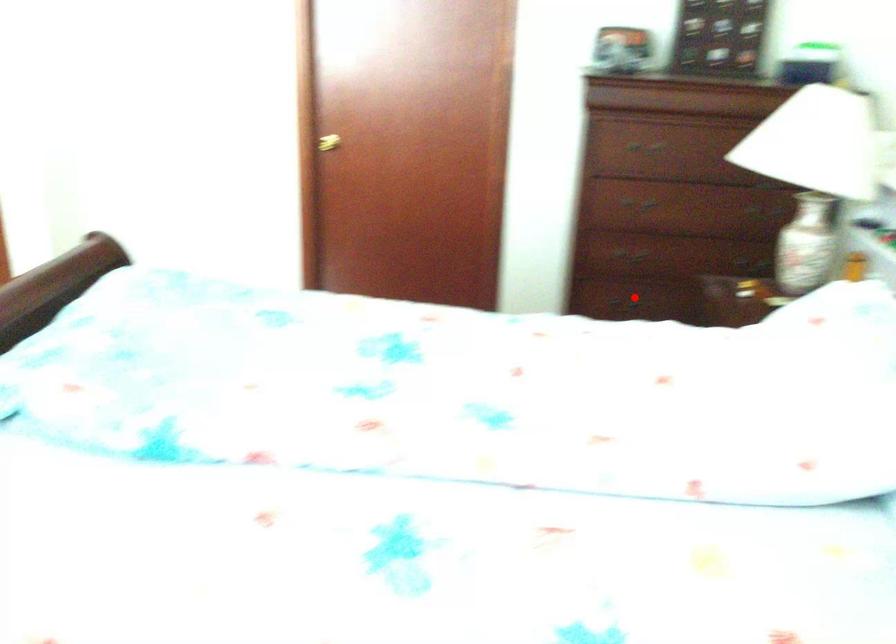
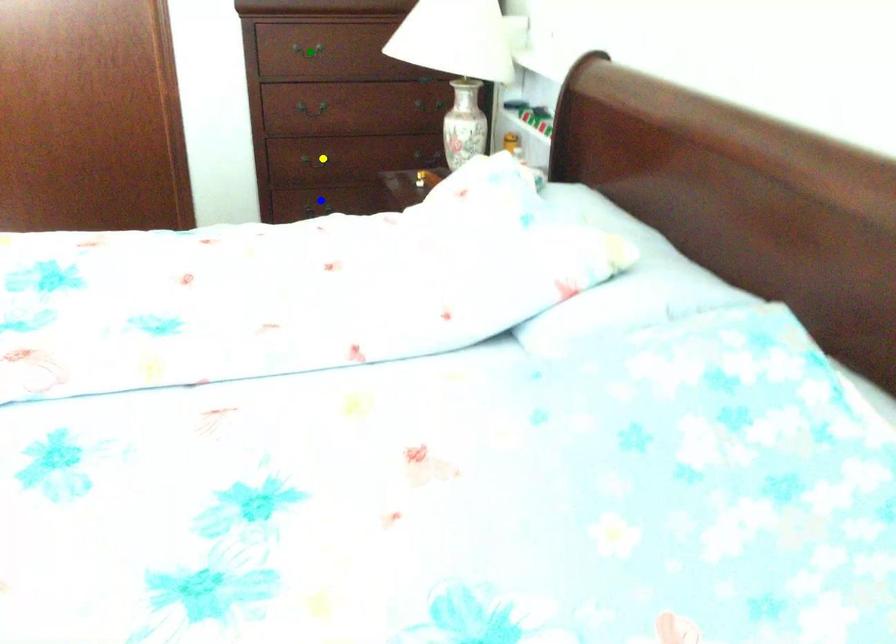
Question: I am providing you with two images of the same scene from different viewpoints. A red point is marked on the first image. You are given multiple points on the second image. In image 2, which mark is for the same physical point as the one in image 1?

Choices:
 (A) green point
 (B) yellow point
 (C) blue point

Answer: (C)